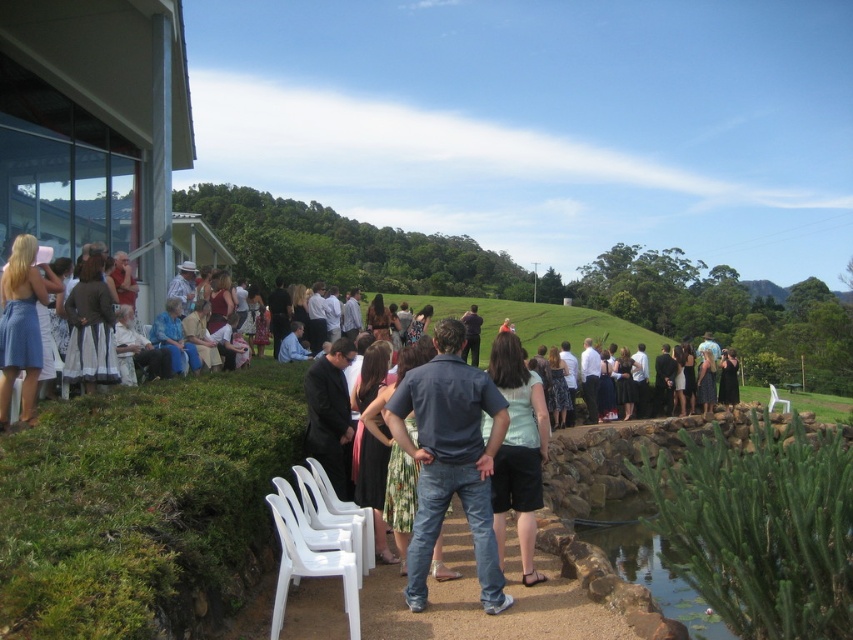
Question: Estimate the real-world distances between objects in this image. Which object is farther from the matte blue dress at left?

Choices:
 (A) light blue fabric dress at center
 (B) white plastic chairs at lower center
 (C) green mossy pond at lower right

Answer: (C)

Question: Does dark blue jeans at center have a lesser width compared to white plastic chair at lower right?

Choices:
 (A) yes
 (B) no

Answer: (A)

Question: Can you confirm if light blue fabric dress at center is positioned to the right of matte blue dress at left?

Choices:
 (A) yes
 (B) no

Answer: (A)

Question: Which is farther from the dark blue jeans at center?

Choices:
 (A) white plastic chairs at lower left
 (B) white plastic chairs at lower center

Answer: (A)

Question: Does green mossy pond at lower right have a larger size compared to white plastic chairs at lower center?

Choices:
 (A) no
 (B) yes

Answer: (B)

Question: Among these objects, which one is nearest to the camera?

Choices:
 (A) green mossy pond at lower right
 (B) white plastic chairs at lower center
 (C) dark blue jeans at center

Answer: (C)